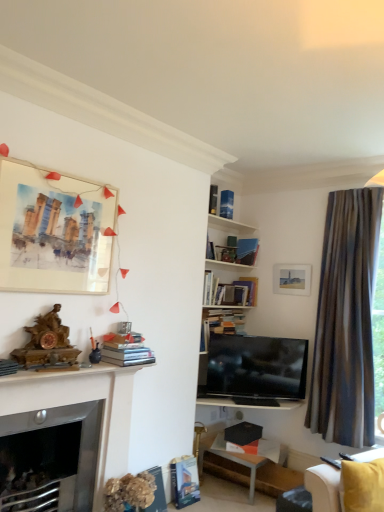
Question: Based on their sizes in the image, would you say hardcover book at upper center, which ranks as the eighth book in bottom-to-top order, is bigger or smaller than hardcover book at lower center, the second book from the bottom?

Choices:
 (A) small
 (B) big

Answer: (A)

Question: Would you say hardcover book at upper center, which ranks as the eighth book in bottom-to-top order, is to the left or to the right of hardcover book at lower center, acting as the seventh book starting from the top, in the picture?

Choices:
 (A) left
 (B) right

Answer: (B)

Question: Which object is positioned closest to the hardcover book at lower center, which is the third book in bottom-to-top order?

Choices:
 (A) yellow fabric couch at lower right
 (B) matte white picture frame at upper right, acting as the 1th picture frame starting from the right
 (C) white glossy fireplace at lower left
 (D) brown striped curtain at right
 (E) hardcover book at upper center, which is the seventh book from bottom to top

Answer: (C)

Question: Which object is the farthest from the matte white picture frame at upper right, the 1th picture frame positioned from the back?

Choices:
 (A) hardcover book at lower center, which is the third book in bottom-to-top order
 (B) hardcover book at lower center, the second book from the bottom
 (C) hardcover book at upper center, which is the seventh book from bottom to top
 (D) watercolor paper painting at upper left, which is the second picture frame from back to front
 (E) black glossy tv at center

Answer: (D)